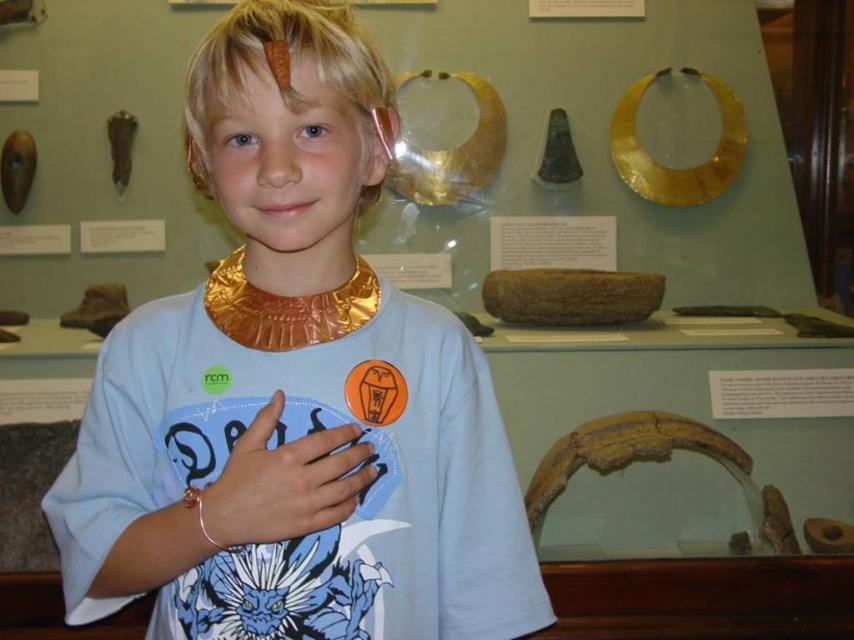
Is point (256, 625) closer to camera compared to point (351, 493)?

That is False.

Can you confirm if matte gold necklace at center is shorter than matte gold bracelet at center?

No, matte gold necklace at center is not shorter than matte gold bracelet at center.

Between point (297, 141) and point (291, 506), which one is positioned behind?

Point (297, 141)

This screenshot has height=640, width=854. Find the location of `matte gold necklace at center`. matte gold necklace at center is located at coordinates click(x=294, y=392).